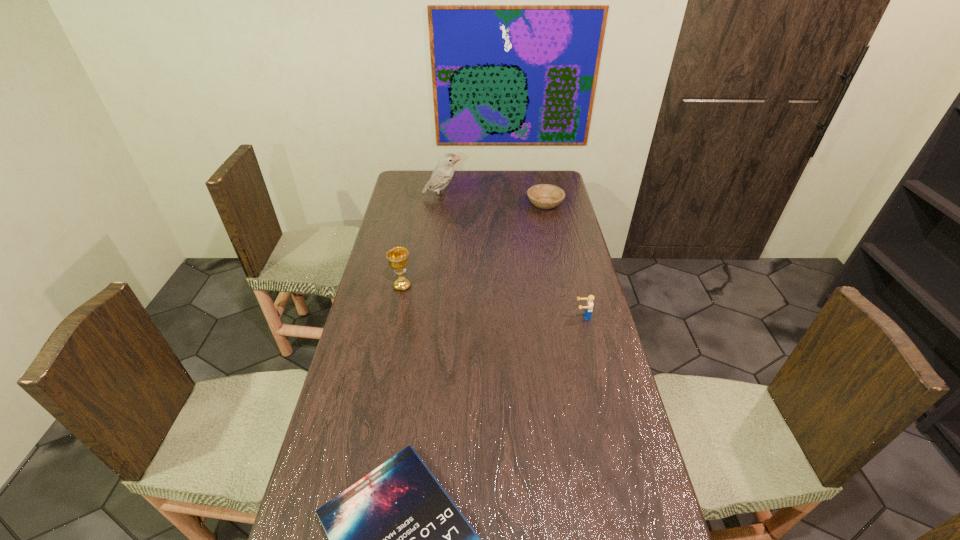
At what (x,y) coordinates should I click in order to perform the action: click on free location that satisfies the following two spatial constraints: 1. at the face of the bird; 2. on the back side of the fourth tallest object. Please return your answer as a coordinate pair (x, y). This screenshot has height=540, width=960. Looking at the image, I should click on (442, 204).

This screenshot has width=960, height=540. Identify the location of blank area in the image that satisfies the following two spatial constraints: 1. at the face of the tallest object; 2. on the left side of the fourth tallest object. (442, 204).